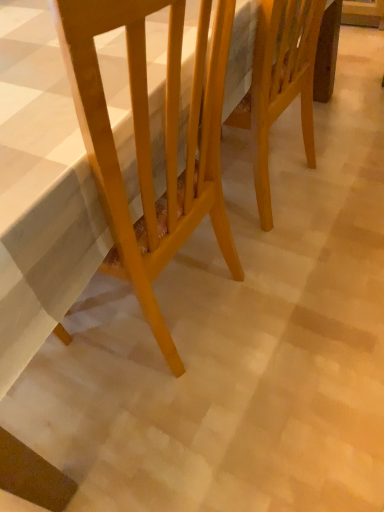
Measure the distance between matte yellow chair at center and camera.

The distance of matte yellow chair at center from camera is 39.69 centimeters.

Identify the location of matte yellow chair at center. (149, 141).

What do you see at coordinates (149, 141) in the screenshot? Image resolution: width=384 pixels, height=512 pixels. I see `matte yellow chair at center` at bounding box center [149, 141].

You are a GUI agent. You are given a task and a screenshot of the screen. Output one action in this format:
    pyautogui.click(x=<x>, y=<y>)
    Task: Click on the matte yellow chair at center
    This screenshot has width=384, height=512.
    Given the screenshot: What is the action you would take?
    pyautogui.click(x=149, y=141)